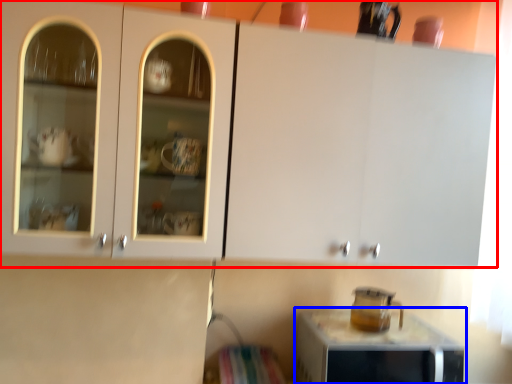
Question: Among these objects, which one is nearest to the camera, cabinetry (highlighted by a red box) or home appliance (highlighted by a blue box)?

Choices:
 (A) cabinetry
 (B) home appliance

Answer: (A)